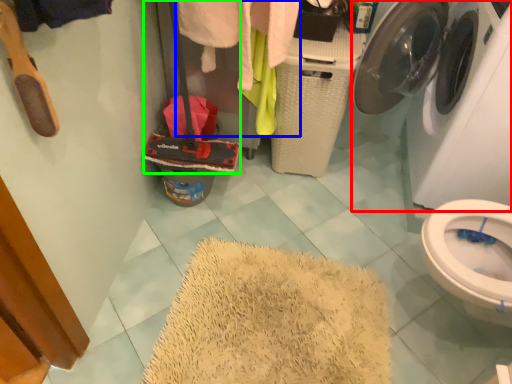
Question: Which object is the farthest from washing machine (highlighted by a red box)? Choose among these: clothing (highlighted by a blue box) or luggage (highlighted by a green box).

Choices:
 (A) clothing
 (B) luggage

Answer: (B)